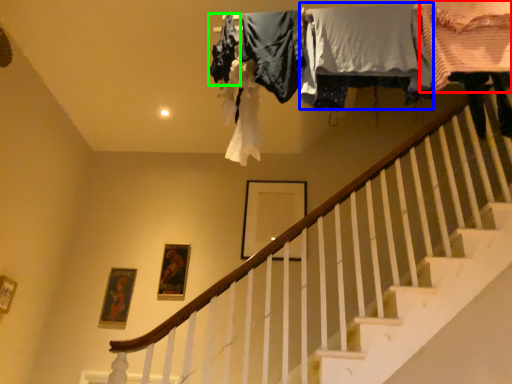
Question: Estimate the real-world distances between objects in this image. Which object is farther from clothing (highlighted by a red box), clothing (highlighted by a blue box) or clothing (highlighted by a green box)?

Choices:
 (A) clothing
 (B) clothing

Answer: (B)